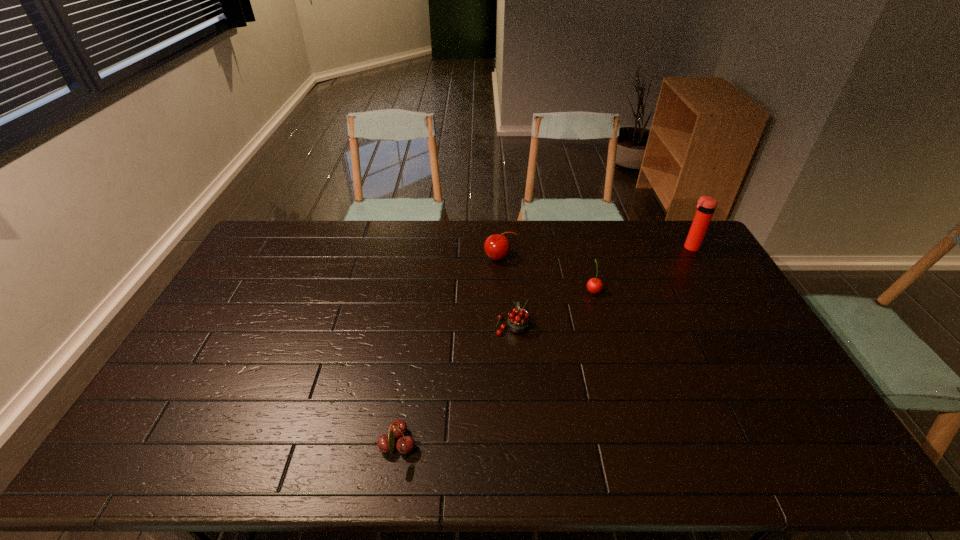
Identify the location of vacant area that lies between the tallest object and the second farthest cherry. (641, 269).

Locate an element on the screen. empty space between the thermos bottle and the rightmost cherry is located at coordinates (641, 269).

At what (x,y) coordinates should I click in order to perform the action: click on vacant area that lies between the rightmost cherry and the thermos bottle. Please return your answer as a coordinate pair (x, y). The width and height of the screenshot is (960, 540). Looking at the image, I should click on (641, 269).

Image resolution: width=960 pixels, height=540 pixels. I want to click on vacant point located between the farthest cherry and the third farthest cherry, so click(506, 292).

The image size is (960, 540). I want to click on the second closest object to the nearest cherry, so click(497, 246).

This screenshot has width=960, height=540. What are the coordinates of `object that is the fourth closest to the farthest cherry` in the screenshot? It's located at (386, 443).

Locate an element on the screen. The width and height of the screenshot is (960, 540). the closest cherry to the third nearest object is located at coordinates (518, 319).

Where is `cherry that is the second closest to the farthest cherry`? cherry that is the second closest to the farthest cherry is located at coordinates (594, 285).

At what (x,y) coordinates should I click in order to perform the action: click on vacant area that satisfies the following two spatial constraints: 1. on the front side of the farthest cherry; 2. on the leaves of the nearest object. Please return your answer as a coordinate pair (x, y). This screenshot has height=540, width=960. Looking at the image, I should click on (509, 446).

Locate an element on the screen. The width and height of the screenshot is (960, 540). free location that satisfies the following two spatial constraints: 1. on the handle side of the second nearest cherry; 2. on the left side of the rightmost object is located at coordinates (506, 247).